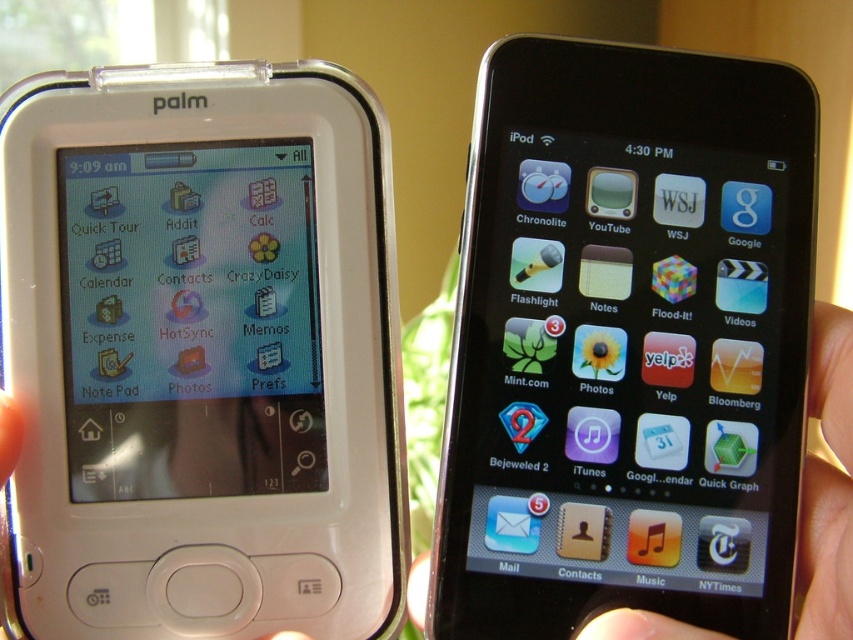
Consider the image. You are holding both devices in your hands. Which device is positioned higher up when comparing the black glossy ipod at upper right and the skinsmoothhand at right?

The black glossy ipod at upper right is located above the skinsmoothhand at right, so it is positioned higher up.

You are holding two iPod devices side by side. The white plastic iPod at left and the black glossy iPod at upper right. Which one is positioned more to the left?

The white plastic iPod at left is positioned more to the left than the black glossy iPod at upper right.